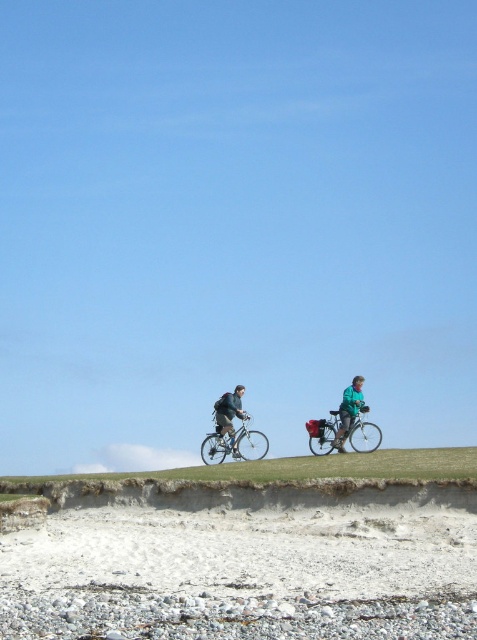
You are planning to set up a small tent for a picnic. You have two options for placement based on the image provided. The first option is on the green grassy hill at center, and the second is near the matte black bicycle at center. Considering the space available, which location would allow the tent to be placed without overlapping any objects?

The green grassy hill at center is wider than the matte black bicycle at center, so placing the tent on the green grassy hill at center would provide more space and avoid overlapping objects.